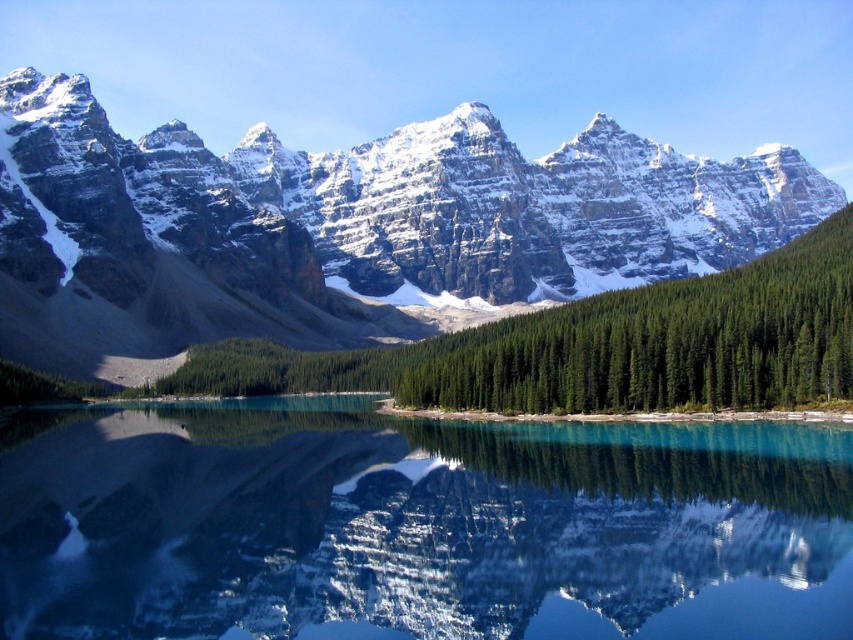
Question: Does clear glass water at center appear under green matte forest at center?

Choices:
 (A) yes
 (B) no

Answer: (A)

Question: Considering the relative positions of snowy rock mountain range at upper center and green matte forest at center in the image provided, where is snowy rock mountain range at upper center located with respect to green matte forest at center?

Choices:
 (A) left
 (B) right

Answer: (A)

Question: Which object is closer to the camera taking this photo?

Choices:
 (A) clear glass water at center
 (B) green matte forest at center
 (C) snowy rock mountain range at upper center

Answer: (A)

Question: Considering the real-world distances, which object is farthest from the clear glass water at center?

Choices:
 (A) snowy rock mountain range at upper center
 (B) green matte forest at center

Answer: (A)

Question: Which point is closer to the camera taking this photo?

Choices:
 (A) (221, 364)
 (B) (489, 282)

Answer: (A)

Question: Does clear glass water at center appear over green matte forest at center?

Choices:
 (A) yes
 (B) no

Answer: (B)